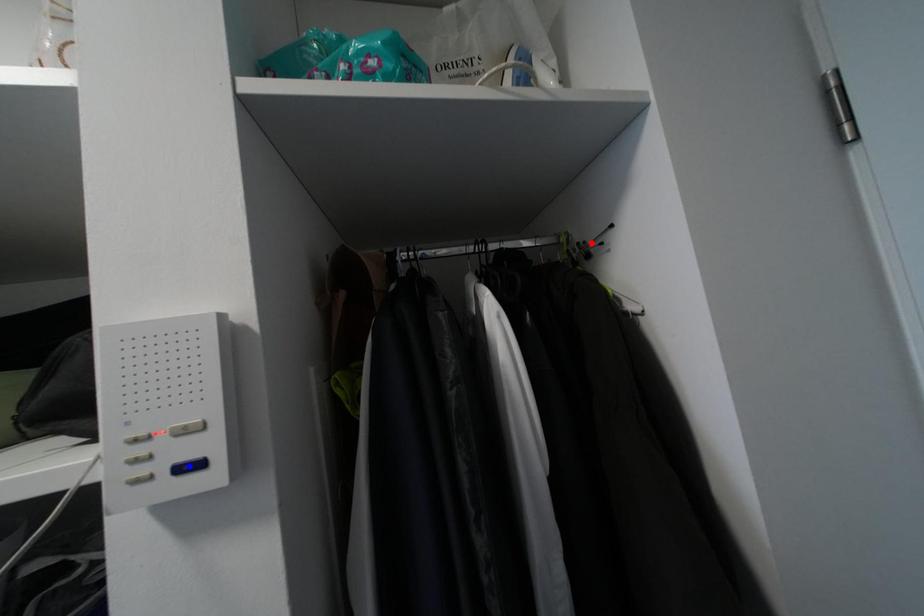
Question: Two points are marked on the image. Which point is closer to the camera?

Choices:
 (A) Blue point is closer.
 (B) Red point is closer.

Answer: (A)